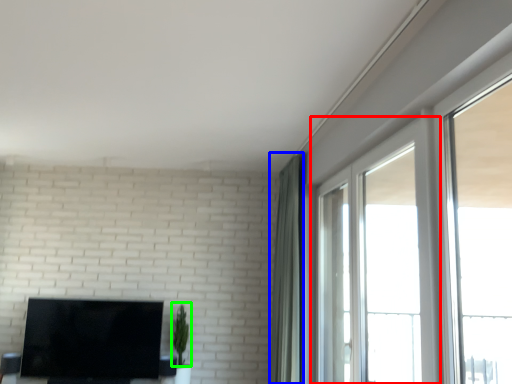
Question: Which object is the closest to the window (highlighted by a red box)? Choose among these: curtain (highlighted by a blue box) or plant (highlighted by a green box).

Choices:
 (A) curtain
 (B) plant

Answer: (A)